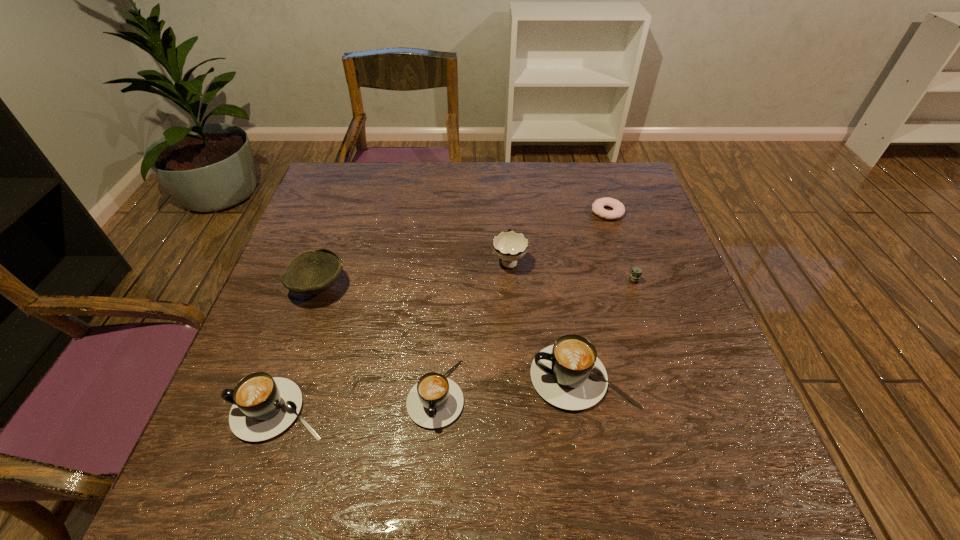
The image size is (960, 540). In order to click on free point that keeps the cappuccinos evenly spaced on the right in this screenshot , I will do `click(722, 362)`.